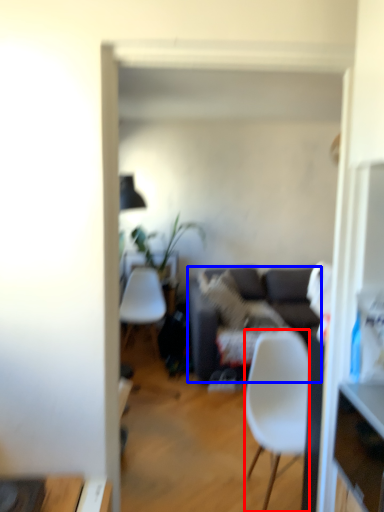
Question: Which object is closer to the camera taking this photo, chair (highlighted by a red box) or studio couch (highlighted by a blue box)?

Choices:
 (A) chair
 (B) studio couch

Answer: (A)